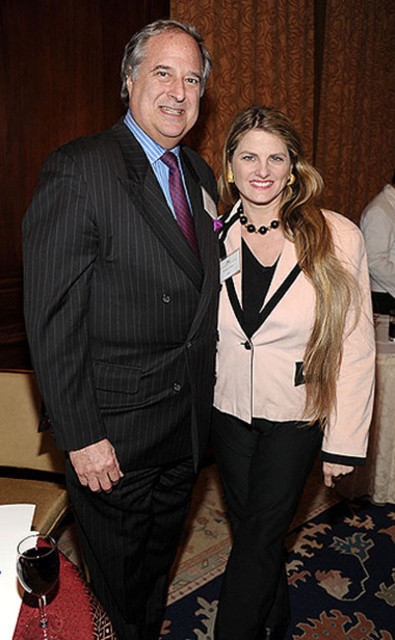
You are a photographer setting up for a group photo. You need to ensure that both the pink fabric jacket at center and the black pinstripe suit at center are fully visible in the frame. Based on their widths, which one might require more space to the left or right to avoid being cut off?

The pink fabric jacket at center might be wider than the black pinstripe suit at center, so it might require more space to the left or right to avoid being cut off.

You are a photographer setting up for a group photo. You need to ensure that the pinstriped suit at center and the dark wood table at lower left are both visible in the frame. Based on their positions, which object should be placed closer to the camera to ensure both are in focus?

The dark wood table at lower left should be placed closer to the camera because the pinstriped suit at center is above it, so adjusting the table position can help maintain focus on both objects.